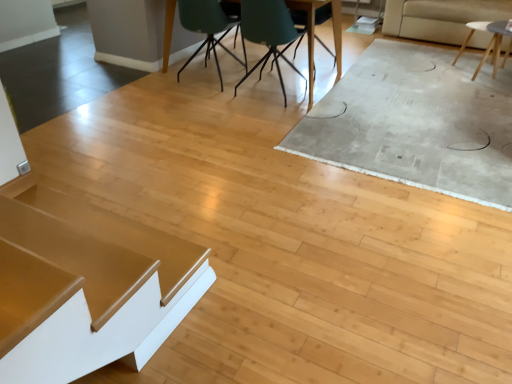
Question: Considering the positions of teal fabric chair at center, the 1th chair in the right-to-left sequence, and matte teal chair at upper center, placed as the 3th chair when sorted from right to left, in the image, is teal fabric chair at center, the 1th chair in the right-to-left sequence, taller or shorter than matte teal chair at upper center, placed as the 3th chair when sorted from right to left,?

Choices:
 (A) tall
 (B) short

Answer: (B)

Question: From a real-world perspective, is teal fabric chair at center, which ranks as the 3th chair in left-to-right order, above or below matte teal chair at upper center, placed as the 3th chair when sorted from right to left?

Choices:
 (A) below
 (B) above

Answer: (A)

Question: Which object is positioned closest to the matte black table at center, marked as the 1th table in a top-to-bottom arrangement?

Choices:
 (A) teal fabric chair at center, which ranks as the 3th chair in left-to-right order
 (B) white matte table at upper right, the third table in the front-to-back sequence
 (C) matte teal chair at upper center, which is counted as the first chair, starting from the left
 (D) shiny gold table at lower left, the first table positioned from the left
 (E) beige fabric couch at upper right

Answer: (A)

Question: Which object is positioned farthest from the beige fabric couch at upper right?

Choices:
 (A) teal matte chair at center, acting as the 2th chair starting from the left
 (B) teal fabric chair at center, which ranks as the 3th chair in left-to-right order
 (C) matte black table at center, the second table positioned from the right
 (D) shiny gold table at lower left, which is the first table from bottom to top
 (E) white matte table at upper right, which is the 2th table in bottom-to-top order

Answer: (D)